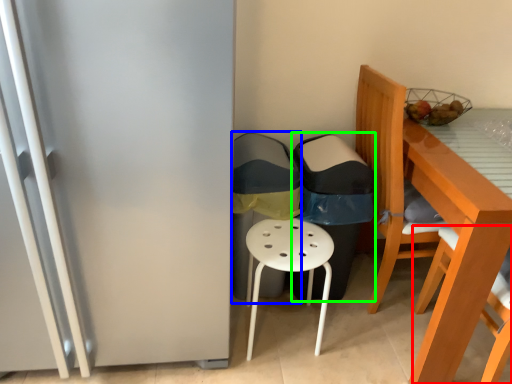
Question: Considering the real-world distances, which object is farthest from chair (highlighted by a red box)? garbage (highlighted by a blue box) or garbage (highlighted by a green box)?

Choices:
 (A) garbage
 (B) garbage

Answer: (A)